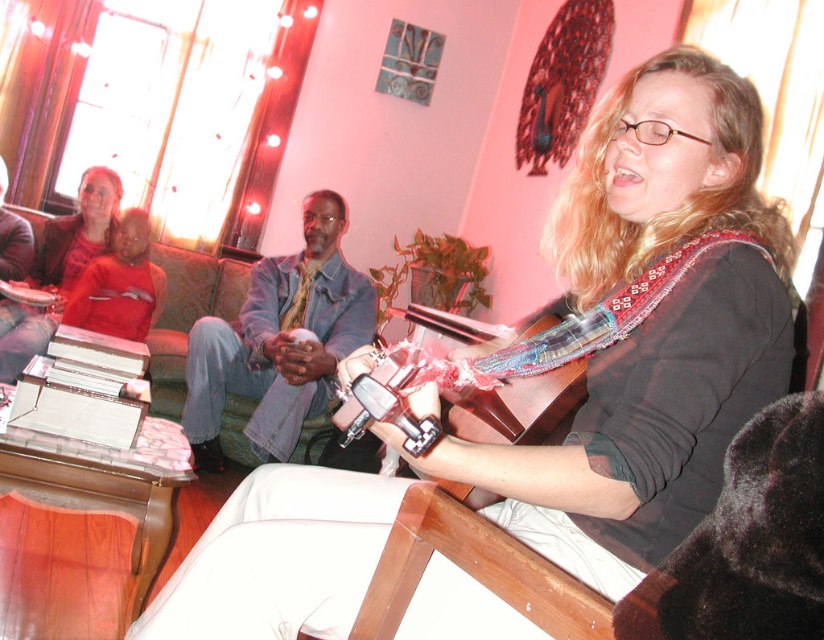
You are a guest at the event and want to hand the performer a drink. You have a tray with a glass of water. The denim jacket at center and the metallic silver guitar at center are in your way. Which object should you move first to reach the performer?

You should move the denim jacket at center first because it is in front of the metallic silver guitar at center, so it is closer to you and blocking the path.

You are a guest at this event and want to grab the metallic silver guitar at center to join the music session. However, there is a denim jacket at center in the way. Based on their positions, can you reach the guitar without moving the jacket?

The denim jacket at center is to the left of the metallic silver guitar at center, so you can reach the guitar by moving around the right side of the jacket.

You are at a social event in the living room and want to grab a jacket to stay warm. Which item is closer to the floor, the denim jacket at center or the matte red shirt at upper left?

The denim jacket at center is located below matte red shirt at upper left, so it is closer to the floor.